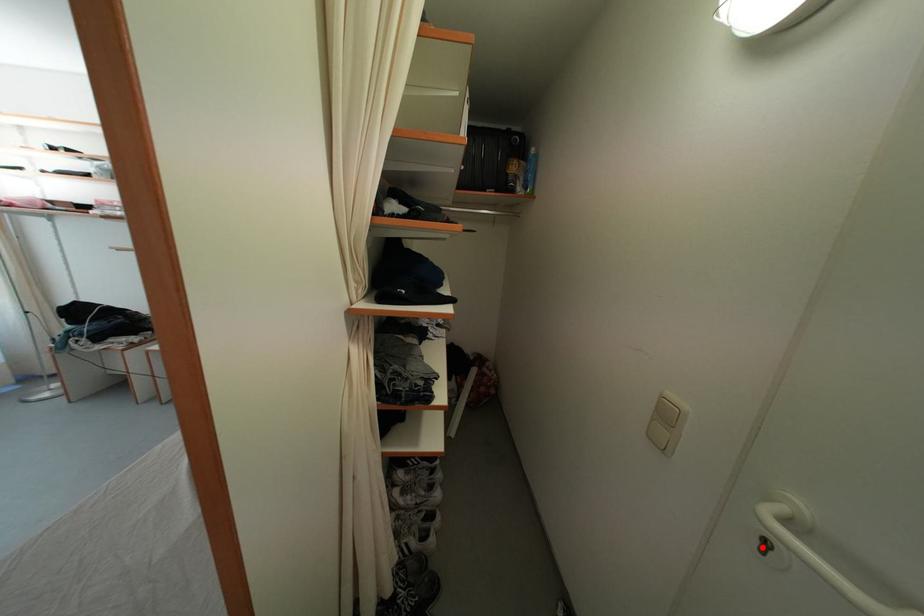
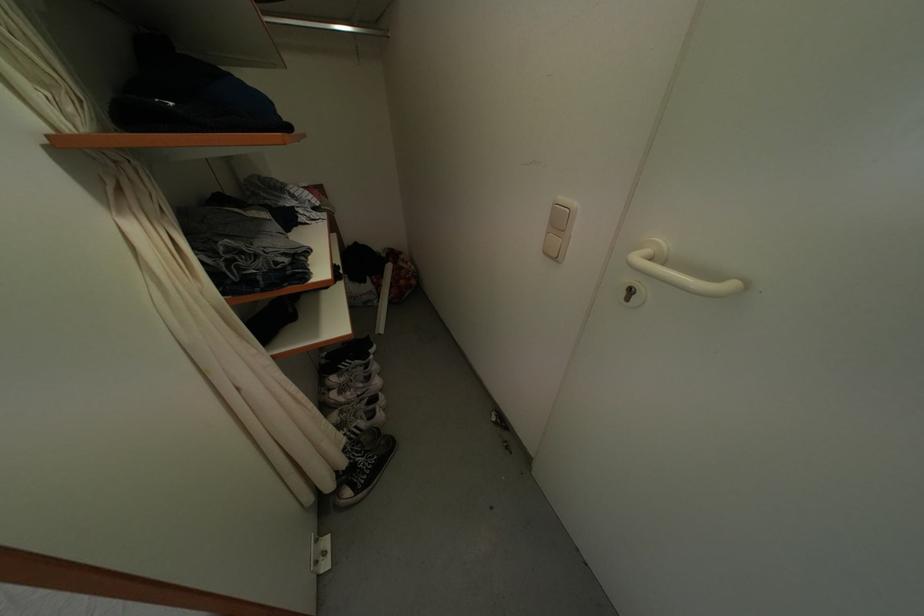
Find the pixel in the second image that matches the highlighted location in the first image.

(630, 299)